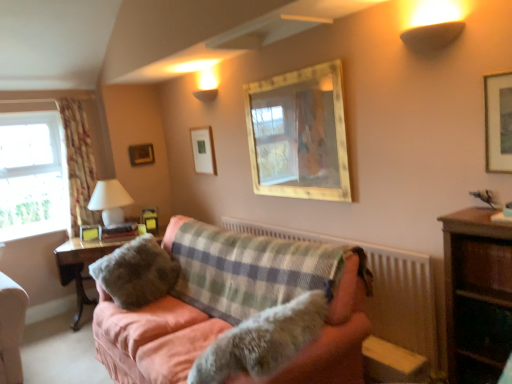
What do you see at coordinates (298, 134) in the screenshot? I see `gold textured mirror at upper center, which is the 2th picture frame from right to left` at bounding box center [298, 134].

This screenshot has height=384, width=512. Describe the element at coordinates (136, 273) in the screenshot. I see `fuzzy fabric pillow at center` at that location.

Find the location of a particular element. Image resolution: width=512 pixels, height=384 pixels. wooden bookshelf at right, the 1th table from the right is located at coordinates (477, 295).

This screenshot has width=512, height=384. What do you see at coordinates (152, 339) in the screenshot?
I see `plaid fabric couch at center` at bounding box center [152, 339].

What do you see at coordinates (203, 150) in the screenshot? This screenshot has width=512, height=384. I see `matte white picture frame at upper center, marked as the third picture frame in a front-to-back arrangement` at bounding box center [203, 150].

Find the location of `wooden picture frame at lower left, which is counted as the fourth picture frame, starting from the front`. wooden picture frame at lower left, which is counted as the fourth picture frame, starting from the front is located at coordinates (90, 232).

Which object is further away from the camera taking this photo, gold-framed picture at upper right, the 1th picture frame from the front, or fuzzy fabric pillow at center?

fuzzy fabric pillow at center is further away from the camera.

Measure the distance between gold-framed picture at upper right, the 6th picture frame when ordered from left to right, and fuzzy fabric pillow at center.

2.30 meters.

I want to click on pillow directly beneath the gold-framed picture at upper right, which appears as the 1th picture frame when viewed from the right (from a real-world perspective), so click(x=136, y=273).

Which is further, (490, 118) or (146, 282)?

Point (146, 282)

Considering the relative sizes of wooden picture frame at lower left, which is counted as the fourth picture frame, starting from the front, and white glossy table lamp at left in the image provided, is wooden picture frame at lower left, which is counted as the fourth picture frame, starting from the front, wider than white glossy table lamp at left?

No, wooden picture frame at lower left, which is counted as the fourth picture frame, starting from the front, is not wider than white glossy table lamp at left.

I want to click on picture frame that is the 2nd one when counting downward from the white glossy table lamp at left (from the image's perspective), so click(x=90, y=232).

Considering the sizes of objects wooden picture frame at lower left, positioned as the first picture frame in left-to-right order, and white glossy table lamp at left in the image provided, who is taller, wooden picture frame at lower left, positioned as the first picture frame in left-to-right order, or white glossy table lamp at left?

Standing taller between the two is white glossy table lamp at left.

In the image, is wooden picture frame at lower left, positioned as the first picture frame in left-to-right order, on the left side or the right side of white glossy table lamp at left?

In the image, wooden picture frame at lower left, positioned as the first picture frame in left-to-right order, appears on the left side of white glossy table lamp at left.

Which of these two, white glossy table lamp at left or wooden picture frame at upper center, the 1th picture frame when ordered from back to front, is smaller?

wooden picture frame at upper center, the 1th picture frame when ordered from back to front.

Which is nearer, (103, 188) or (150, 155)?

Point (103, 188) is positioned closer to the camera compared to point (150, 155).

Between white glossy table lamp at left and wooden picture frame at upper center, the 2th picture frame when ordered from left to right, which one is positioned in front?

white glossy table lamp at left is closer to the camera.

From the white glossy table lamp at left, count 2nd picture frames backward and point to it. Please provide its 2D coordinates.

[(141, 154)]

Is plaid fabric couch at center oriented away from floral fabric curtain at left?

No, plaid fabric couch at center's orientation is not away from floral fabric curtain at left.

Is plaid fabric couch at center not near floral fabric curtain at left?

plaid fabric couch at center is positioned a significant distance from floral fabric curtain at left.

Based on the photo, from the image's perspective, which object appears higher, plaid fabric couch at center or floral fabric curtain at left?

From the image's view, floral fabric curtain at left is above.

In the image, is plaid fabric couch at center positioned in front of or behind floral fabric curtain at left?

Clearly, plaid fabric couch at center is in front of floral fabric curtain at left.

From the image's perspective, which object appears higher, gold textured mirror at upper center, arranged as the 5th picture frame when viewed from the left, or wooden picture frame at lower left, which is counted as the fourth picture frame, starting from the front?

gold textured mirror at upper center, arranged as the 5th picture frame when viewed from the left.

Considering their positions, is gold textured mirror at upper center, arranged as the 5th picture frame when viewed from the left, located in front of or behind wooden picture frame at lower left, which ranks as the 6th picture frame in right-to-left order?

Clearly, gold textured mirror at upper center, arranged as the 5th picture frame when viewed from the left, is in front of wooden picture frame at lower left, which ranks as the 6th picture frame in right-to-left order.

Is gold textured mirror at upper center, which appears as the fifth picture frame when viewed from the back, taller or shorter than wooden picture frame at lower left, which ranks as the 6th picture frame in right-to-left order?

Clearly, gold textured mirror at upper center, which appears as the fifth picture frame when viewed from the back, is taller compared to wooden picture frame at lower left, which ranks as the 6th picture frame in right-to-left order.

Based on the photo, which of these two, gold textured mirror at upper center, the second picture frame positioned from the front, or wooden picture frame at lower left, positioned as the first picture frame in left-to-right order, is smaller?

Smaller between the two is wooden picture frame at lower left, positioned as the first picture frame in left-to-right order.

Is plaid fabric couch at center wider than wooden picture frame at upper center, the 6th picture frame viewed from the front?

Indeed, plaid fabric couch at center has a greater width compared to wooden picture frame at upper center, the 6th picture frame viewed from the front.

Would you say wooden picture frame at upper center, arranged as the 5th picture frame when viewed from the right, is part of plaid fabric couch at center's contents?

No, plaid fabric couch at center does not contain wooden picture frame at upper center, arranged as the 5th picture frame when viewed from the right.

Is plaid fabric couch at center next to wooden picture frame at upper center, arranged as the 5th picture frame when viewed from the right, and touching it?

No, plaid fabric couch at center is not touching wooden picture frame at upper center, arranged as the 5th picture frame when viewed from the right.

Is plaid fabric couch at center oriented away from wooden picture frame at upper center, arranged as the 5th picture frame when viewed from the right?

No, plaid fabric couch at center's orientation is not away from wooden picture frame at upper center, arranged as the 5th picture frame when viewed from the right.

Is floral fabric curtain at left directly adjacent to matte gold wall sconce at upper right?

No, floral fabric curtain at left is not in contact with matte gold wall sconce at upper right.

Which of these two, floral fabric curtain at left or matte gold wall sconce at upper right, is bigger?

With larger size is floral fabric curtain at left.

You are a GUI agent. You are given a task and a screenshot of the screen. Output one action in this format:
    pyautogui.click(x=<x>, y=<y>)
    Task: Click on the lamp above the floral fabric curtain at left (from the image's perspective)
    
    Given the screenshot: What is the action you would take?
    pyautogui.click(x=431, y=36)

Can you confirm if floral fabric curtain at left is shorter than matte gold wall sconce at upper right?

Incorrect, the height of floral fabric curtain at left does not fall short of that of matte gold wall sconce at upper right.

The height and width of the screenshot is (384, 512). I want to click on pillow beneath the gold-framed picture at upper right, which appears as the 1th picture frame when viewed from the right (from a real-world perspective), so (x=136, y=273).

Where is `table lamp behind the wooden picture frame at lower left, which ranks as the 6th picture frame in right-to-left order`? table lamp behind the wooden picture frame at lower left, which ranks as the 6th picture frame in right-to-left order is located at coordinates (110, 201).

Based on their spatial positions, is gold textured mirror at upper center, the second picture frame positioned from the front, or fuzzy fur dog at center closer to wooden bookshelf at right, which is the first table from front to back?

Based on the image, fuzzy fur dog at center appears to be nearer to wooden bookshelf at right, which is the first table from front to back.

Looking at this image, looking at the image, which one is located closer to gold-framed picture at upper right, the 6th picture frame when ordered from left to right, woodenmaterial/texturetable at left, positioned as the first table in left-to-right order, or fuzzy fabric pillow at center?

fuzzy fabric pillow at center.

Consider the image. Looking at the image, which one is located further to fuzzy fur dog at center, matte gold wall sconce at upper right or wooden bookshelf at right, the 2th table when ordered from back to front?

matte gold wall sconce at upper right lies further to fuzzy fur dog at center than the other object.

Considering their positions, is wooden bookshelf at right, which ranks as the second table in left-to-right order, positioned closer to plaid fabric couch at center than matte yellow picture frame at center, which is the third picture frame from left to right?

Among the two, matte yellow picture frame at center, which is the third picture frame from left to right, is located nearer to plaid fabric couch at center.

Considering their positions, is matte yellow picture frame at center, acting as the fourth picture frame starting from the right, positioned closer to plaid fabric couch at center than gold textured mirror at upper center, which is the 2th picture frame from right to left?

matte yellow picture frame at center, acting as the fourth picture frame starting from the right, is closer to plaid fabric couch at center.

Looking at the image, which one is located further to wooden bookshelf at right, the 2th table when ordered from back to front, matte white picture frame at upper center, which appears as the 3th picture frame when viewed from the right, or fuzzy fur dog at center?

matte white picture frame at upper center, which appears as the 3th picture frame when viewed from the right, is further to wooden bookshelf at right, the 2th table when ordered from back to front.

Which object lies nearer to the anchor point matte yellow picture frame at center, the 5th picture frame positioned from the front, fuzzy fur dog at center or gold textured mirror at upper center, which appears as the fifth picture frame when viewed from the back?

Based on the image, gold textured mirror at upper center, which appears as the fifth picture frame when viewed from the back, appears to be nearer to matte yellow picture frame at center, the 5th picture frame positioned from the front.

Considering their positions, is white glossy table lamp at left positioned closer to clear glass window at left than plaid fabric couch at center?

The object closer to clear glass window at left is white glossy table lamp at left.

Locate an element on the screen. The width and height of the screenshot is (512, 384). table between clear glass window at left and wooden bookshelf at right, the 1th table from the right, from left to right is located at coordinates (82, 265).

Find the location of `pillow between fuzzy fur dog at center and floral fabric curtain at left in the front-back direction`. pillow between fuzzy fur dog at center and floral fabric curtain at left in the front-back direction is located at coordinates (136, 273).

Identify the location of picture frame located between fuzzy fabric pillow at center and wooden picture frame at lower left, the third picture frame when ordered from back to front, in the depth direction. Image resolution: width=512 pixels, height=384 pixels. (203, 150).

The width and height of the screenshot is (512, 384). Find the location of `lamp between gold-framed picture at upper right, which appears as the 1th picture frame when viewed from the right, and wooden picture frame at upper center, arranged as the 5th picture frame when viewed from the right, in the front-back direction`. lamp between gold-framed picture at upper right, which appears as the 1th picture frame when viewed from the right, and wooden picture frame at upper center, arranged as the 5th picture frame when viewed from the right, in the front-back direction is located at coordinates (431, 36).